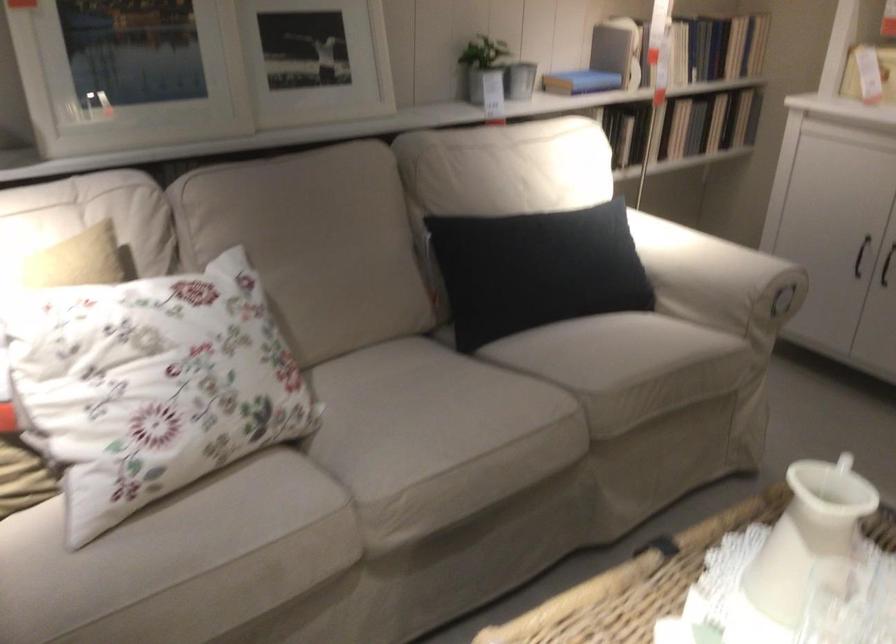
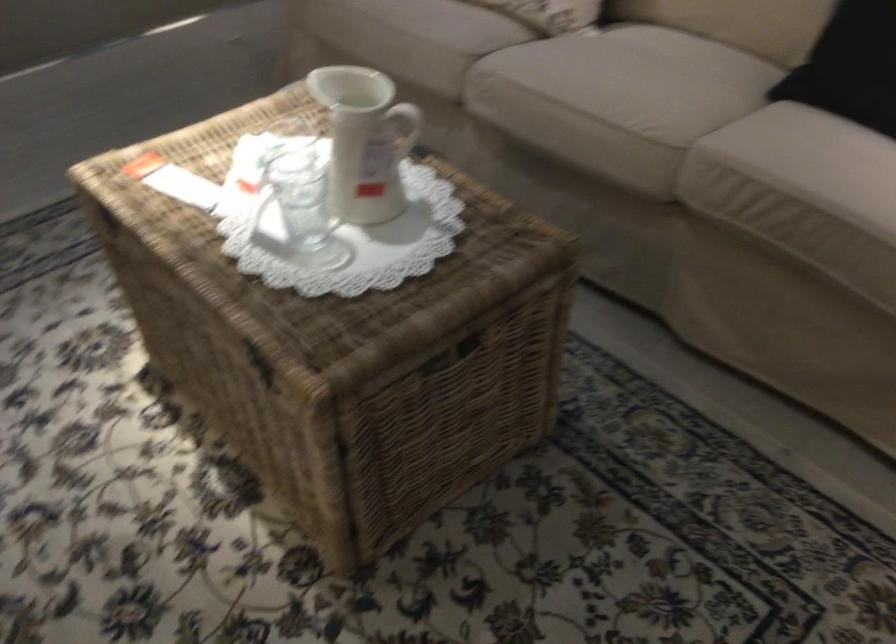
Locate, in the second image, the point that corresponds to point 814,520 in the first image.

(365, 140)